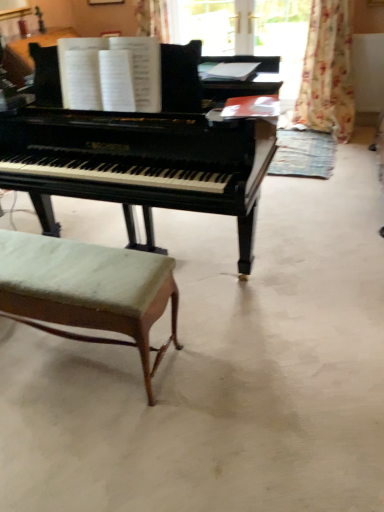
Question: Is black polished piano at center taller or shorter than floral fabric curtain at upper right?

Choices:
 (A) tall
 (B) short

Answer: (B)

Question: From the image's perspective, is black polished piano at center positioned above or below floral fabric curtain at upper right?

Choices:
 (A) below
 (B) above

Answer: (A)

Question: Which object is the farthest from the black piano at center?

Choices:
 (A) floral fabric curtain at upper right
 (B) black polished piano at center
 (C) green fabric stool at lower left

Answer: (A)

Question: Based on their relative distances, which object is farther from the floral fabric curtain at upper right?

Choices:
 (A) black polished piano at center
 (B) green fabric stool at lower left
 (C) black piano at center

Answer: (B)